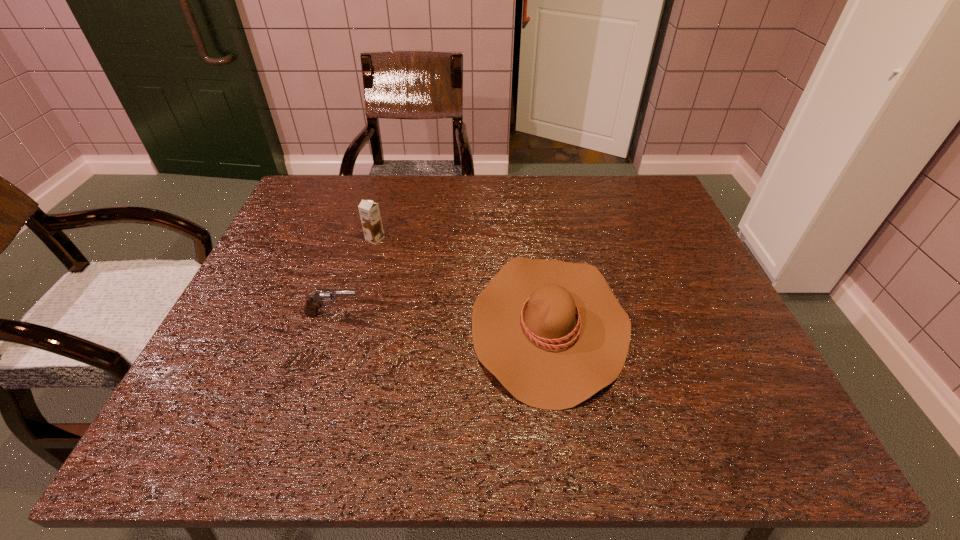
Image resolution: width=960 pixels, height=540 pixels. In the image, there is a desktop. In order to click on vacant space at the right edge in this screenshot , I will do `click(686, 264)`.

This screenshot has width=960, height=540. I want to click on free spot at the far left corner of the desktop, so click(x=328, y=184).

Identify the location of free space at the near right corner. (774, 421).

Where is `free space between the rightmost object and the farthest object`? free space between the rightmost object and the farthest object is located at coordinates (462, 281).

Where is `vacant area between the pistol and the cowboy hat`? This screenshot has width=960, height=540. vacant area between the pistol and the cowboy hat is located at coordinates (441, 319).

This screenshot has width=960, height=540. I want to click on free area in between the chocolate milk and the pistol, so click(x=354, y=276).

The width and height of the screenshot is (960, 540). In order to click on free space that is in between the pistol and the chocolate milk in this screenshot , I will do `click(354, 276)`.

At what (x,y) coordinates should I click in order to perform the action: click on empty space between the cowboy hat and the pistol. Please return your answer as a coordinate pair (x, y). Looking at the image, I should click on (441, 319).

What are the coordinates of `vacant space that's between the pistol and the chocolate milk` in the screenshot? It's located at (354, 276).

Identify the location of unoccupied area between the pistol and the chocolate milk. This screenshot has height=540, width=960. (354, 276).